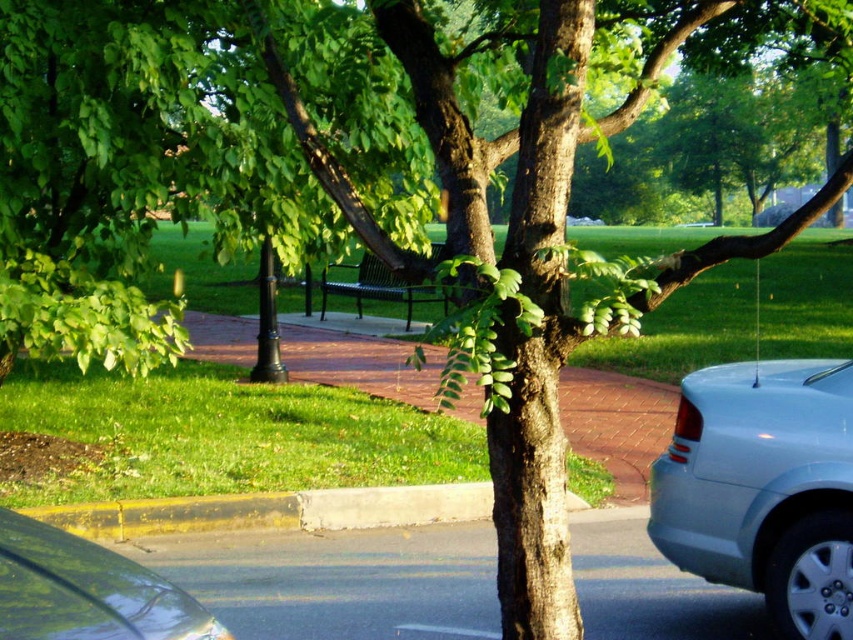
You are a pedestrian standing at the park entrance and want to cross the road to reach the black metal bench under the tree. There is a satin silver sedan at lower right and a clear glass windshield at lower left in your view. Which object should you look out for to ensure safety while crossing?

The satin silver sedan at lower right is above the clear glass windshield at lower left, meaning it is closer to you. You should look out for the satin silver sedan at lower right first as it is nearer and might be moving, ensuring safety while crossing.

You are standing at the point labeled point (39, 614) and want to walk towards the point labeled point (469, 486). Which direction should you face to move directly towards your destination?

Since point (39, 614) is in front of point 0.761, 0552, you should face backwards to move directly towards point (469, 486).